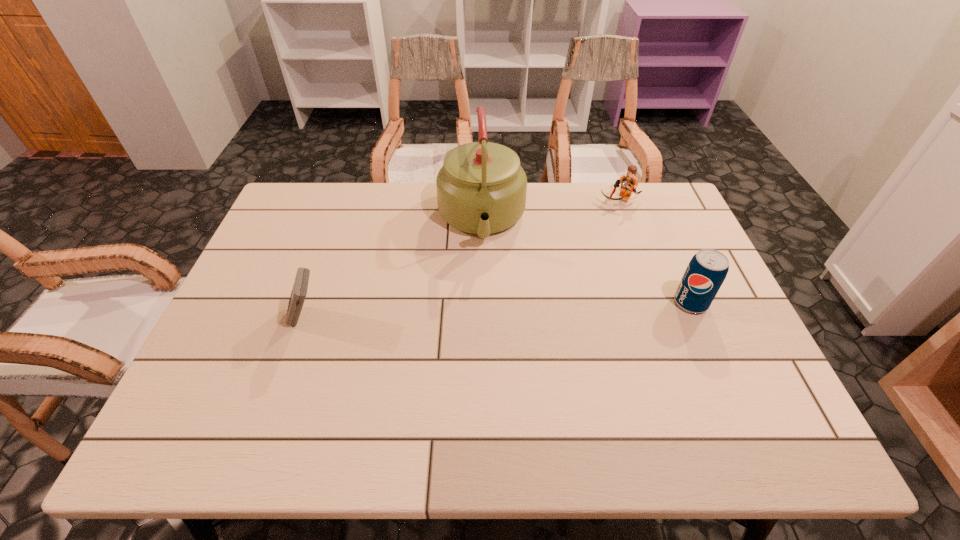
I want to click on free space that satisfies the following two spatial constraints: 1. on the front side of the third object from right to left; 2. on the left side of the pop, so click(x=482, y=302).